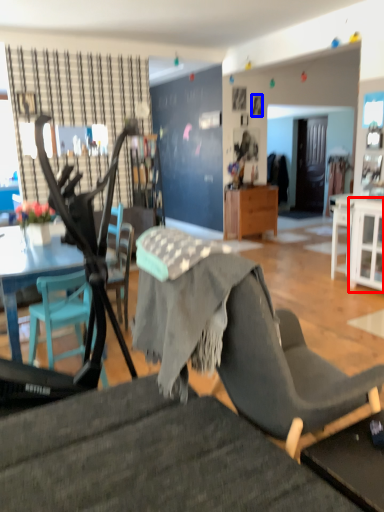
Question: Which point is further to the camera, cabinetry (highlighted by a red box) or picture frame (highlighted by a blue box)?

Choices:
 (A) cabinetry
 (B) picture frame

Answer: (B)